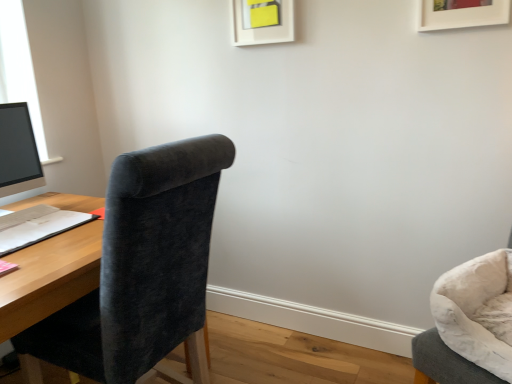
Locate an element on the screen. velvet grey chair at right, placed as the 1th chair when sorted from right to left is located at coordinates (467, 323).

I want to click on matte black monitor at left, so click(x=18, y=151).

Locate an element on the screen. The image size is (512, 384). white matte picture frame at upper right, the 2th picture frame positioned from the left is located at coordinates (461, 13).

This screenshot has width=512, height=384. What are the coordinates of `white paper at left` in the screenshot? It's located at [x=37, y=226].

What do you see at coordinates (142, 265) in the screenshot? I see `velvet dark gray chair at left, the first chair viewed from the left` at bounding box center [142, 265].

Image resolution: width=512 pixels, height=384 pixels. What are the coordinates of `velvet grey chair at right, placed as the 1th chair when sorted from right to left` in the screenshot? It's located at (467, 323).

Between white matte picture frame at upper right, the 1th picture frame viewed from the right, and velvet dark gray chair at left, the second chair from the right, which one is positioned behind?

white matte picture frame at upper right, the 1th picture frame viewed from the right, is further from the camera.

Could velvet dark gray chair at left, the first chair viewed from the left, be considered to be inside white matte picture frame at upper right, the 1th picture frame viewed from the right?

Actually, velvet dark gray chair at left, the first chair viewed from the left, is outside white matte picture frame at upper right, the 1th picture frame viewed from the right.

Locate an element on the screen. the 2nd chair positioned below the white matte picture frame at upper right, the 1th picture frame in the front-to-back sequence (from a real-world perspective) is located at coordinates (142, 265).

Looking at their sizes, would you say velvet dark gray chair at left, the second chair from the right, is wider or thinner than velvet grey chair at right, placed as the 1th chair when sorted from right to left?

Considering their sizes, velvet dark gray chair at left, the second chair from the right, looks broader than velvet grey chair at right, placed as the 1th chair when sorted from right to left.

Which of these two, velvet dark gray chair at left, the first chair viewed from the left, or velvet grey chair at right, placed as the 1th chair when sorted from right to left, is bigger?

velvet dark gray chair at left, the first chair viewed from the left.

Who is taller, velvet dark gray chair at left, the second chair from the right, or velvet grey chair at right, arranged as the 2th chair when viewed from the left?

velvet dark gray chair at left, the second chair from the right.

Is velvet dark gray chair at left, the second chair from the right, not within velvet grey chair at right, placed as the 1th chair when sorted from right to left?

Yes, velvet dark gray chair at left, the second chair from the right, is not within velvet grey chair at right, placed as the 1th chair when sorted from right to left.

From a real-world perspective, is matte black monitor at left on white matte picture frame at upper center, positioned as the second picture frame in right-to-left order?

Incorrect, from a real-world perspective, matte black monitor at left is lower than white matte picture frame at upper center, positioned as the second picture frame in right-to-left order.

Is the position of matte black monitor at left less distant than that of white matte picture frame at upper center, the second picture frame positioned from the front?

That is True.

Considering the points (29, 166) and (255, 10), which point is behind, point (29, 166) or point (255, 10)?

The point (29, 166) is farther from the camera.

In terms of size, does matte black monitor at left appear bigger or smaller than white matte picture frame at upper center, the second picture frame positioned from the front?

matte black monitor at left is bigger than white matte picture frame at upper center, the second picture frame positioned from the front.

Does point (8, 168) appear closer or farther from the camera than point (173, 309)?

Point (8, 168).

Which object is thinner, matte black monitor at left or velvet dark gray chair at left, the first chair viewed from the left?

With smaller width is matte black monitor at left.

Which is in front, matte black monitor at left or velvet dark gray chair at left, the first chair viewed from the left?

velvet dark gray chair at left, the first chair viewed from the left, is in front.

In the scene shown: Is matte black monitor at left positioned far away from velvet dark gray chair at left, the first chair viewed from the left?

That's not correct — matte black monitor at left is a little close to velvet dark gray chair at left, the first chair viewed from the left.

Who is bigger, velvet grey chair at right, placed as the 1th chair when sorted from right to left, or velvet dark gray chair at left, the first chair viewed from the left?

With larger size is velvet dark gray chair at left, the first chair viewed from the left.

Does velvet grey chair at right, arranged as the 2th chair when viewed from the left, come in front of velvet dark gray chair at left, the second chair from the right?

No, velvet grey chair at right, arranged as the 2th chair when viewed from the left, is further to the viewer.

Is velvet grey chair at right, placed as the 1th chair when sorted from right to left, facing towards velvet dark gray chair at left, the second chair from the right?

No, velvet grey chair at right, placed as the 1th chair when sorted from right to left, does not turn towards velvet dark gray chair at left, the second chair from the right.

Which object is thinner, velvet grey chair at right, arranged as the 2th chair when viewed from the left, or velvet dark gray chair at left, the second chair from the right?

Thinner between the two is velvet grey chair at right, arranged as the 2th chair when viewed from the left.

In the image, is matte black monitor at left positioned in front of or behind velvet grey chair at right, placed as the 1th chair when sorted from right to left?

matte black monitor at left is behind velvet grey chair at right, placed as the 1th chair when sorted from right to left.

Does matte black monitor at left have a greater width compared to velvet grey chair at right, arranged as the 2th chair when viewed from the left?

In fact, matte black monitor at left might be narrower than velvet grey chair at right, arranged as the 2th chair when viewed from the left.

Which is in front, point (15, 158) or point (462, 317)?

Point (462, 317)

How different are the orientations of white matte picture frame at upper center, placed as the 1th picture frame when sorted from left to right, and white paper at left in degrees?

There is a 88.6-degree angle between the facing directions of white matte picture frame at upper center, placed as the 1th picture frame when sorted from left to right, and white paper at left.

Does point (244, 34) lie in front of point (9, 221)?

No, it is not.

Which object is positioned more to the right, white matte picture frame at upper center, the second picture frame positioned from the front, or white paper at left?

From the viewer's perspective, white matte picture frame at upper center, the second picture frame positioned from the front, appears more on the right side.

In the image, is white matte picture frame at upper center, positioned as the second picture frame in right-to-left order, positioned in front of or behind white paper at left?

In the image, white matte picture frame at upper center, positioned as the second picture frame in right-to-left order, appears behind white paper at left.

Identify the location of the 1st picture frame directly above the velvet dark gray chair at left, the first chair viewed from the left (from a real-world perspective). This screenshot has width=512, height=384. (461, 13).

Identify the location of chair below the velvet grey chair at right, arranged as the 2th chair when viewed from the left (from a real-world perspective). The image size is (512, 384). (142, 265).

From the image, which object appears to be farther from velvet dark gray chair at left, the first chair viewed from the left, matte black monitor at left or white paper at left?

matte black monitor at left is further to velvet dark gray chair at left, the first chair viewed from the left.

Estimate the real-world distances between objects in this image. Which object is closer to velvet grey chair at right, placed as the 1th chair when sorted from right to left, white matte picture frame at upper right, the 2th picture frame positioned from the left, or white matte picture frame at upper center, placed as the 1th picture frame when sorted from left to right?

The object closer to velvet grey chair at right, placed as the 1th chair when sorted from right to left, is white matte picture frame at upper right, the 2th picture frame positioned from the left.

When comparing their distances from matte black monitor at left, does white paper at left or white matte picture frame at upper center, placed as the 1th picture frame when sorted from left to right, seem further?

The object further to matte black monitor at left is white matte picture frame at upper center, placed as the 1th picture frame when sorted from left to right.

In the scene shown: Based on their spatial positions, is velvet grey chair at right, placed as the 1th chair when sorted from right to left, or white matte picture frame at upper right, the 1th picture frame in the front-to-back sequence, closer to matte black monitor at left?

Based on the image, white matte picture frame at upper right, the 1th picture frame in the front-to-back sequence, appears to be nearer to matte black monitor at left.

Considering their positions, is matte black monitor at left positioned closer to velvet dark gray chair at left, the first chair viewed from the left, than velvet grey chair at right, placed as the 1th chair when sorted from right to left?

The object closer to velvet dark gray chair at left, the first chair viewed from the left, is velvet grey chair at right, placed as the 1th chair when sorted from right to left.

When comparing their distances from velvet grey chair at right, placed as the 1th chair when sorted from right to left, does matte black monitor at left or white matte picture frame at upper center, positioned as the second picture frame in right-to-left order, seem further?

matte black monitor at left.

From the image, which object appears to be nearer to velvet grey chair at right, arranged as the 2th chair when viewed from the left, velvet dark gray chair at left, the first chair viewed from the left, or white paper at left?

velvet dark gray chair at left, the first chair viewed from the left.

Considering their positions, is velvet grey chair at right, arranged as the 2th chair when viewed from the left, positioned closer to matte black monitor at left than white paper at left?

white paper at left is positioned closer to the anchor matte black monitor at left.

Where is `picture frame between white paper at left and white matte picture frame at upper right, the 1th picture frame in the front-to-back sequence, in the horizontal direction`? picture frame between white paper at left and white matte picture frame at upper right, the 1th picture frame in the front-to-back sequence, in the horizontal direction is located at coordinates (262, 21).

Locate an element on the screen. This screenshot has width=512, height=384. picture frame between matte black monitor at left and white matte picture frame at upper right, the 1th picture frame viewed from the right, from left to right is located at coordinates coord(262,21).

At what (x,y) coordinates should I click in order to perform the action: click on picture frame between white matte picture frame at upper center, positioned as the second picture frame in right-to-left order, and velvet dark gray chair at left, the first chair viewed from the left, vertically. Please return your answer as a coordinate pair (x, y). Image resolution: width=512 pixels, height=384 pixels. Looking at the image, I should click on (461, 13).

In order to click on chair between white matte picture frame at upper center, placed as the 1th picture frame when sorted from left to right, and velvet dark gray chair at left, the second chair from the right, in the vertical direction in this screenshot , I will do `click(467, 323)`.